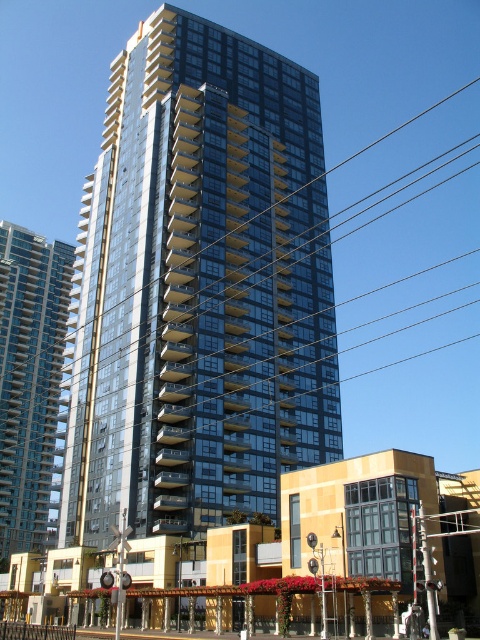
You are standing in front of two buildings at the center of the image. The glassy reflective building at center and the transparent glass building at center. Which one is located to the right side?

The glassy reflective building at center is positioned on the right side of transparent glass building at center, so it is the one located to the right side.

You are standing in front of the two buildings described. Which building is closer to you, the glassy reflective building at center or the transparent glass building at center?

The glassy reflective building at center is closer because it is positioned over the transparent glass building at center, meaning it is in front of it.